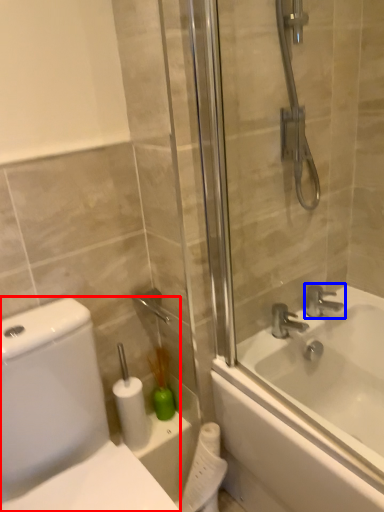
Question: Which of the following is the closest to the observer, porcelain (highlighted by a red box) or tap (highlighted by a blue box)?

Choices:
 (A) porcelain
 (B) tap

Answer: (A)